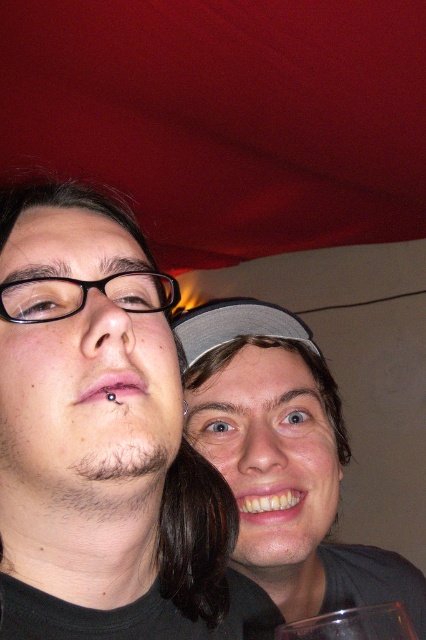
Question: Is matte black hair at upper left thinner than matte gray cap at center?

Choices:
 (A) yes
 (B) no

Answer: (A)

Question: Which object appears farthest from the camera in this image?

Choices:
 (A) matte gray cap at center
 (B) matte black hair at upper left

Answer: (A)

Question: Is matte black hair at upper left wider than matte gray cap at center?

Choices:
 (A) no
 (B) yes

Answer: (A)

Question: Does matte black hair at upper left have a larger size compared to matte gray cap at center?

Choices:
 (A) yes
 (B) no

Answer: (B)